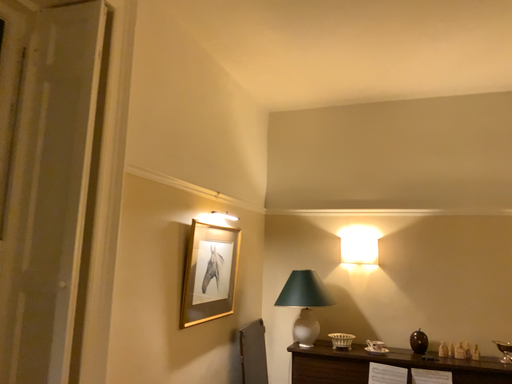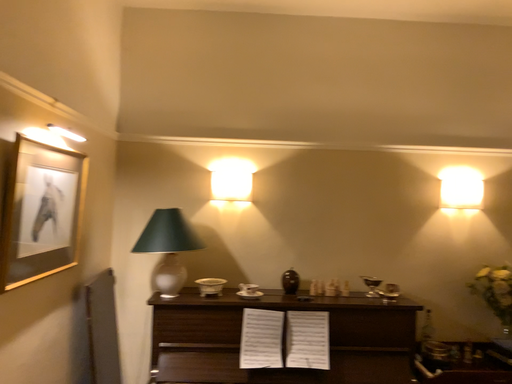
Question: Which way did the camera rotate in the video?

Choices:
 (A) rotated left
 (B) rotated right

Answer: (B)